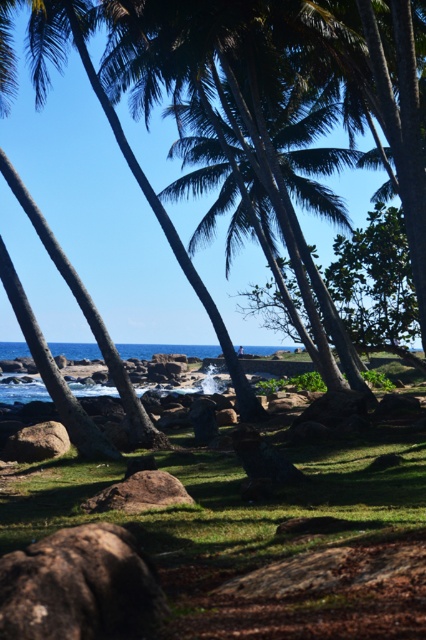
Question: Is green grass at center wider than blue water at center?

Choices:
 (A) yes
 (B) no

Answer: (B)

Question: Which of the following is the farthest from the observer?

Choices:
 (A) green grass at center
 (B) blue water at center

Answer: (B)

Question: Where is green grass at center located in relation to blue water at center in the image?

Choices:
 (A) right
 (B) left

Answer: (A)

Question: Can you confirm if green grass at center is positioned below blue water at center?

Choices:
 (A) no
 (B) yes

Answer: (A)